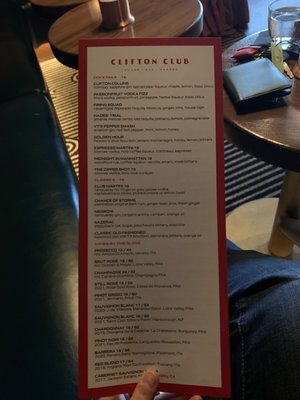
This screenshot has height=400, width=300. Find the location of `table`. table is located at coordinates (271, 116), (78, 27).